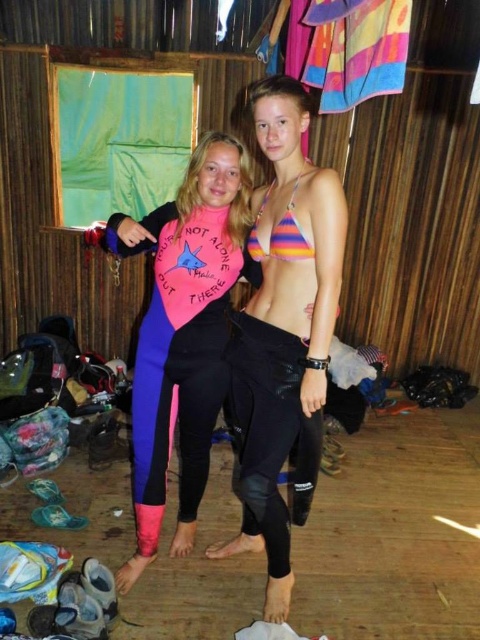
Question: Which of the following is the closest to the observer?

Choices:
 (A) pink neoprene wetsuit at center
 (B) striped fabric bikini top at center
 (C) rainbow striped bikini top at center

Answer: (B)

Question: Which object appears closest to the camera in this image?

Choices:
 (A) striped fabric bikini top at center
 (B) rainbow striped bikini top at center
 (C) pink neoprene wetsuit at center

Answer: (A)

Question: Among these objects, which one is nearest to the camera?

Choices:
 (A) pink neoprene wetsuit at center
 (B) striped fabric bikini top at center
 (C) rainbow striped bikini top at center

Answer: (B)

Question: Can you confirm if striped fabric bikini top at center is bigger than rainbow striped bikini top at center?

Choices:
 (A) no
 (B) yes

Answer: (B)

Question: Is striped fabric bikini top at center to the left of rainbow striped bikini top at center from the viewer's perspective?

Choices:
 (A) no
 (B) yes

Answer: (A)

Question: In this image, where is striped fabric bikini top at center located relative to pink neoprene wetsuit at center?

Choices:
 (A) right
 (B) left

Answer: (A)